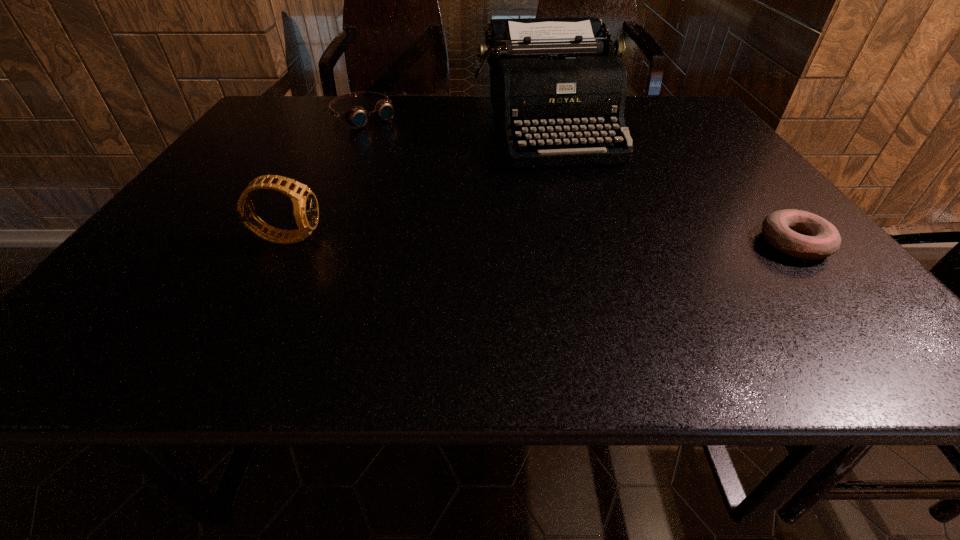
Locate an element on the screen. Image resolution: width=960 pixels, height=540 pixels. free space between the third tallest object and the typewriter is located at coordinates (455, 123).

Identify the location of free spot between the second tallest object and the second shortest object. The height and width of the screenshot is (540, 960). (326, 177).

This screenshot has width=960, height=540. What are the coordinates of `empty location between the doughnut and the third object from left to right` in the screenshot? It's located at (670, 186).

Select which object appears as the second closest to the doughnut. Please provide its 2D coordinates. Your answer should be formatted as a tuple, i.e. [(x, y)], where the tuple contains the x and y coordinates of a point satisfying the conditions above.

[(306, 211)]

Where is `object that stands as the closest to the doughnut`? This screenshot has height=540, width=960. object that stands as the closest to the doughnut is located at coordinates (558, 81).